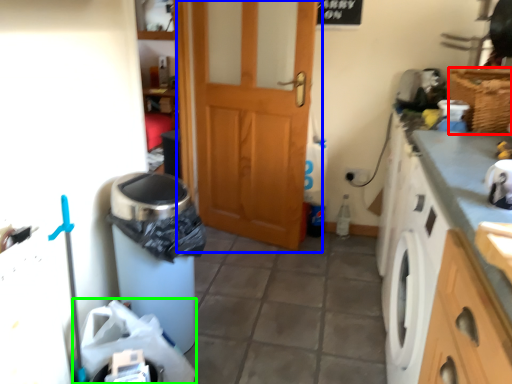
Question: Which object is the closest to the basket (highlighted by a red box)? Choose among these: door (highlighted by a blue box) or garbage (highlighted by a green box).

Choices:
 (A) door
 (B) garbage

Answer: (A)